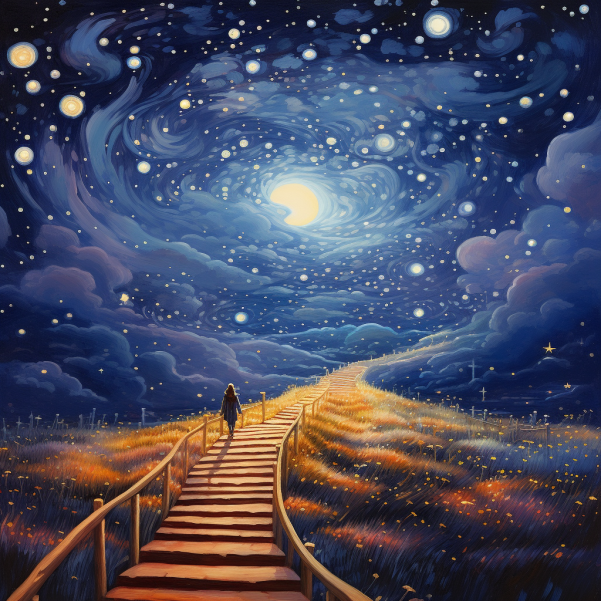
At what (x,y) coordinates should I click in order to perform the action: click on wooden railing. Please return your answer as a coordinate pair (x, y). This screenshot has width=601, height=601. Looking at the image, I should click on (104, 507), (276, 496).